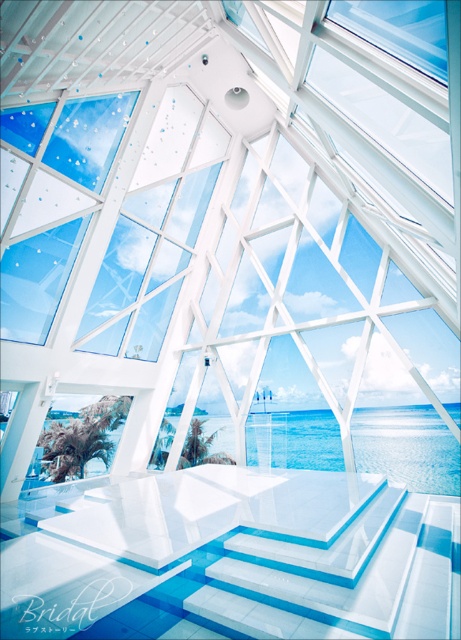
Between point (314, 440) and point (407, 26), which one is positioned behind?

The point (314, 440) is behind.

Is transparent glass water at center bigger than transparent glass window at upper center?

Correct, transparent glass water at center is larger in size than transparent glass window at upper center.

Describe the element at coordinates (407, 445) in the screenshot. The height and width of the screenshot is (640, 461). I see `transparent glass water at center` at that location.

Locate an element on the screen. transparent glass water at center is located at coordinates (407, 445).